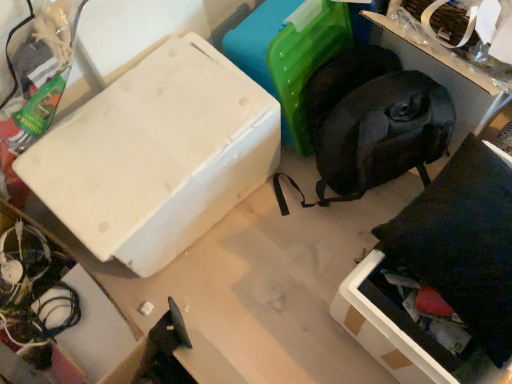
The height and width of the screenshot is (384, 512). I want to click on white matte cardboard box at lower left, so click(57, 304).

From a real-world perspective, relative to white matte box at upper left, is white matte cardboard box at lower left vertically above or below?

white matte cardboard box at lower left is situated higher than white matte box at upper left in the real world.

Would you consider white matte cardboard box at lower left to be distant from white matte box at upper left?

No, white matte cardboard box at lower left is not far away from white matte box at upper left.

I want to click on cardboard box above the white matte box at upper left (from a real-world perspective), so click(x=57, y=304).

Is white matte cardboard box at lower left taller than white matte box at upper left?

Correct, white matte cardboard box at lower left is much taller as white matte box at upper left.

Considering the sizes of objects black fabric bag at upper right and white matte cardboard box at lower left in the image provided, who is shorter, black fabric bag at upper right or white matte cardboard box at lower left?

With less height is white matte cardboard box at lower left.

From the image's perspective, relative to white matte cardboard box at lower left, is black fabric bag at upper right above or below?

Based on their image positions, black fabric bag at upper right is located above white matte cardboard box at lower left.

Image resolution: width=512 pixels, height=384 pixels. I want to click on storage box located on the right of white matte cardboard box at lower left, so click(x=450, y=80).

Which is in front, point (121, 172) or point (490, 79)?

Positioned in front is point (490, 79).

Between white matte box at upper left and black fabric bag at upper right, which one appears on the right side from the viewer's perspective?

From the viewer's perspective, black fabric bag at upper right appears more on the right side.

From a real-world perspective, is white matte box at upper left on top of black fabric bag at upper right?

Actually, white matte box at upper left is physically below black fabric bag at upper right in the real world.

Considering the sizes of objects white matte box at upper left and black fabric bag at upper right in the image provided, who is bigger, white matte box at upper left or black fabric bag at upper right?

black fabric bag at upper right.

Which is in front, point (109, 333) or point (436, 62)?

The point (109, 333) is closer to the camera.

From a real-world perspective, is white matte cardboard box at lower left physically below black fabric bag at upper right?

Yes, from a real-world perspective, white matte cardboard box at lower left is below black fabric bag at upper right.

Are white matte cardboard box at lower left and black fabric bag at upper right making contact?

They are not placed beside each other.

Can you confirm if white matte box at upper left is positioned to the left of white matte cardboard box at lower left?

Incorrect, white matte box at upper left is not on the left side of white matte cardboard box at lower left.

Identify the location of cardboard box in front of the white matte box at upper left. (57, 304).

Is white matte box at upper left positioned beyond the bounds of white matte cardboard box at lower left?

Yes, white matte box at upper left is located beyond the bounds of white matte cardboard box at lower left.

Considering the relative sizes of black fabric bag at upper right and white matte box at upper left in the image provided, is black fabric bag at upper right bigger than white matte box at upper left?

Yes.

Is black fabric bag at upper right wider than white matte box at upper left?

Yes, black fabric bag at upper right is wider than white matte box at upper left.

Is white matte box at upper left completely or partially inside black fabric bag at upper right?

No, white matte box at upper left is located outside of black fabric bag at upper right.

Is black fabric bag at upper right placed right next to white matte box at upper left?

No, black fabric bag at upper right is not making contact with white matte box at upper left.

What are the coordinates of `cardboard box in front of the white matte box at upper left` in the screenshot? It's located at tap(57, 304).

I want to click on storage box located above the white matte cardboard box at lower left (from a real-world perspective), so click(x=450, y=80).

From the image, which object appears to be farther from white matte cardboard box at lower left, black fabric bag at upper right or white matte box at upper left?

Based on the image, black fabric bag at upper right appears to be further to white matte cardboard box at lower left.

Considering their positions, is white matte box at upper left positioned closer to white matte cardboard box at lower left than black fabric bag at upper right?

The object closer to white matte cardboard box at lower left is white matte box at upper left.

Based on their spatial positions, is white matte box at upper left or white matte cardboard box at lower left further from black fabric bag at upper right?

white matte cardboard box at lower left is positioned further to the anchor black fabric bag at upper right.

From the image, which object appears to be nearer to white matte box at upper left, white matte cardboard box at lower left or black fabric bag at upper right?

Based on the image, white matte cardboard box at lower left appears to be nearer to white matte box at upper left.

Which object lies further to the anchor point black fabric bag at upper right, white matte cardboard box at lower left or white matte box at upper left?

Among the two, white matte cardboard box at lower left is located further to black fabric bag at upper right.

Looking at this image, based on their spatial positions, is black fabric bag at upper right or white matte cardboard box at lower left closer to white matte box at upper left?

white matte cardboard box at lower left is closer to white matte box at upper left.

Find the location of `box situated between white matte cardboard box at lower left and black fabric bag at upper right from left to right`. box situated between white matte cardboard box at lower left and black fabric bag at upper right from left to right is located at coordinates (157, 155).